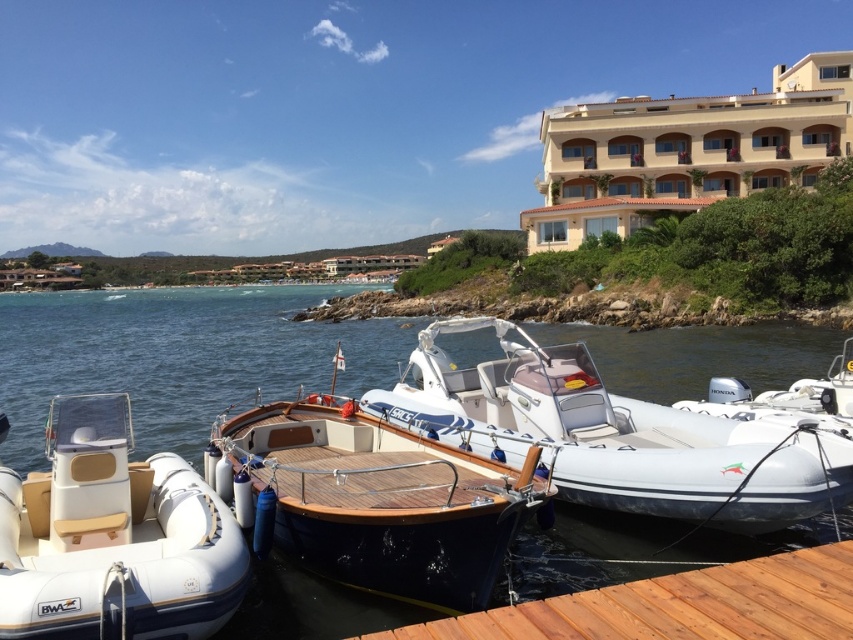
Does brown wooden dock at lower right appear over white rubber boat at right?

No, brown wooden dock at lower right is not above white rubber boat at right.

Which is in front, point (840, 636) or point (822, 401)?

Positioned in front is point (840, 636).

This screenshot has height=640, width=853. I want to click on brown wooden dock at lower right, so click(x=679, y=605).

Does point (114, 413) come behind point (323, 532)?

That is True.

Between white rubber boat at lower left and teak wood boat at center, which one has more height?

Standing taller between the two is white rubber boat at lower left.

Is point (175, 484) more distant than point (384, 582)?

Yes, it is.

You are a GUI agent. You are given a task and a screenshot of the screen. Output one action in this format:
    pyautogui.click(x=<x>, y=<y>)
    Task: Click on the white rubber boat at lower left
    Image resolution: width=853 pixels, height=640 pixels.
    Given the screenshot: What is the action you would take?
    pyautogui.click(x=113, y=538)

Identify the location of teak wood boat at center. (379, 499).

This screenshot has height=640, width=853. What do you see at coordinates (379, 499) in the screenshot?
I see `teak wood boat at center` at bounding box center [379, 499].

Image resolution: width=853 pixels, height=640 pixels. I want to click on teak wood boat at center, so (379, 499).